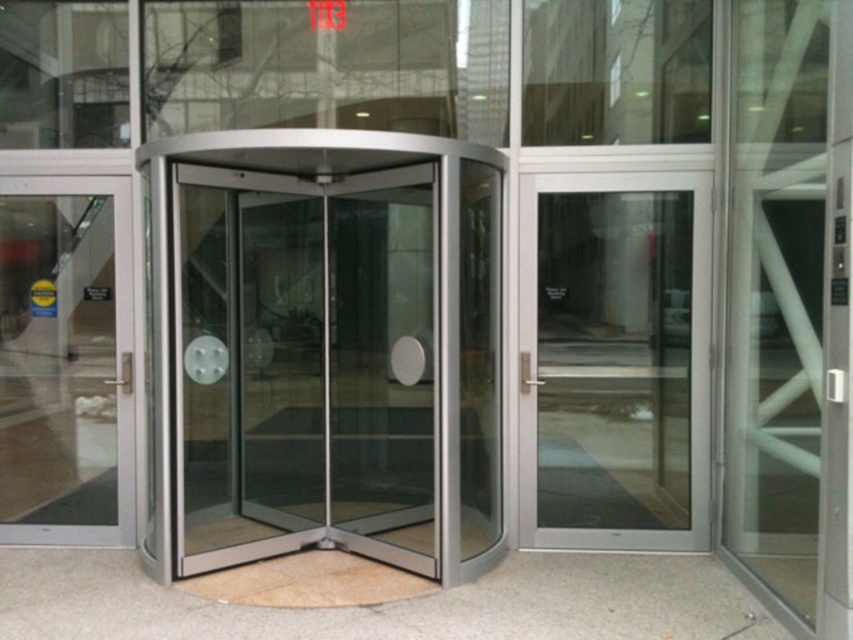
Question: Among these points, which one is farthest from the camera?

Choices:
 (A) (86, 225)
 (B) (672, 237)

Answer: (A)

Question: Can you confirm if clear glass door at right is positioned to the right of transparent glass door at left?

Choices:
 (A) no
 (B) yes

Answer: (B)

Question: Is clear glass door at right further to the viewer compared to transparent glass door at left?

Choices:
 (A) yes
 (B) no

Answer: (B)

Question: Can you confirm if clear glass door at right is wider than transparent glass door at left?

Choices:
 (A) no
 (B) yes

Answer: (A)